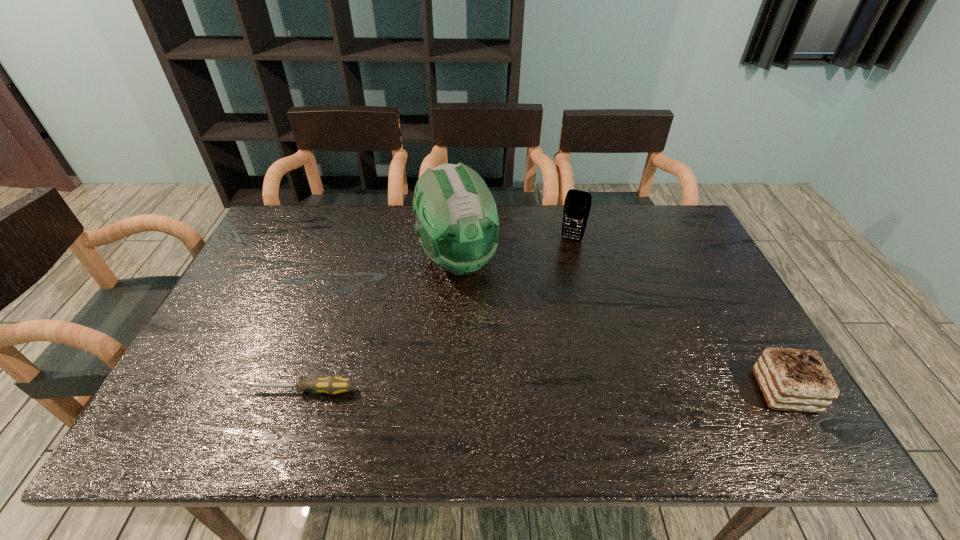
This screenshot has width=960, height=540. In order to click on free spot on the desktop that is between the shortest object and the chocolate cake and is positioned on the screen of the cellular telephone in this screenshot , I will do `click(512, 391)`.

The height and width of the screenshot is (540, 960). I want to click on free spot on the desktop that is between the screwdriver and the chocolate cake and is positioned on the visor of the second object from left to right, so click(x=523, y=391).